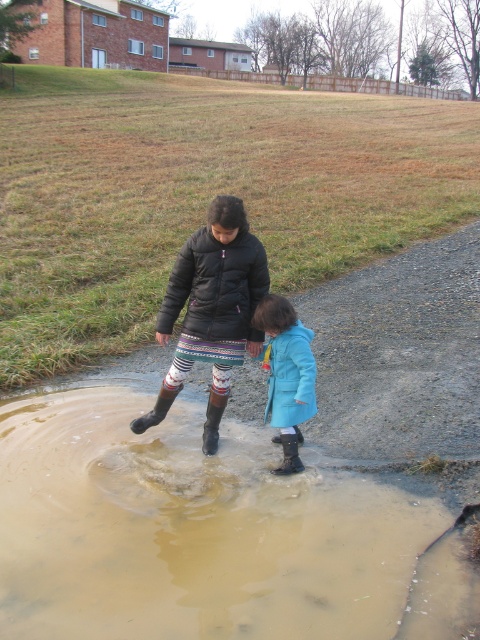
Does black fuzzy jacket at center have a lesser width compared to black rubber rain boot at lower center?

No, black fuzzy jacket at center is not thinner than black rubber rain boot at lower center.

Can you confirm if black fuzzy jacket at center is positioned above black rubber rain boot at lower center?

Correct, black fuzzy jacket at center is located above black rubber rain boot at lower center.

Which is behind, point (224, 330) or point (296, 426)?

Point (296, 426)

This screenshot has height=640, width=480. I want to click on black fuzzy jacket at center, so click(212, 308).

What do you see at coordinates (190, 531) in the screenshot?
I see `brown muddy water at lower center` at bounding box center [190, 531].

Between brown muddy water at lower center and black puffy jacket at center, which one is positioned higher?

black puffy jacket at center is higher up.

In order to click on brown muddy water at lower center in this screenshot , I will do `click(190, 531)`.

Is point (203, 236) behind point (274, 438)?

That is False.

Does black puffy jacket at center have a greater height compared to black rubber rain boot at lower center?

Correct, black puffy jacket at center is much taller as black rubber rain boot at lower center.

Is point (249, 296) positioned behind point (285, 445)?

Yes, it is.

I want to click on black puffy jacket at center, so click(216, 285).